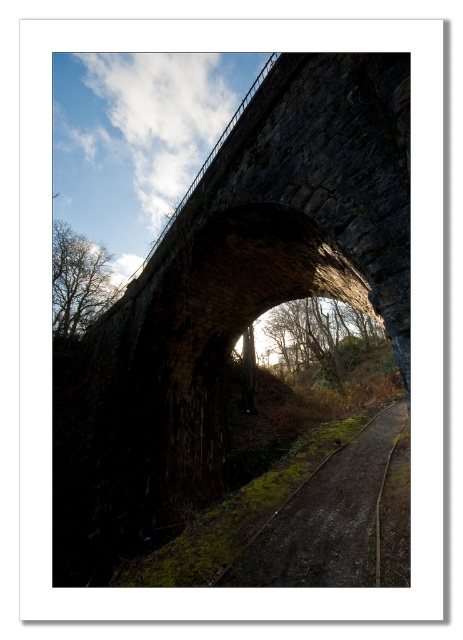
Question: Is the position of dark stone bridge at center less distant than that of brown dirt track at center?

Choices:
 (A) yes
 (B) no

Answer: (A)

Question: Among these points, which one is farthest from the camera?

Choices:
 (A) (358, 433)
 (B) (349, 106)

Answer: (A)

Question: Is the position of dark stone bridge at center more distant than that of brown dirt track at center?

Choices:
 (A) yes
 (B) no

Answer: (B)

Question: Which point is farther to the camera?

Choices:
 (A) brown dirt track at center
 (B) dark stone bridge at center

Answer: (A)

Question: Can you confirm if dark stone bridge at center is bigger than brown dirt track at center?

Choices:
 (A) yes
 (B) no

Answer: (A)